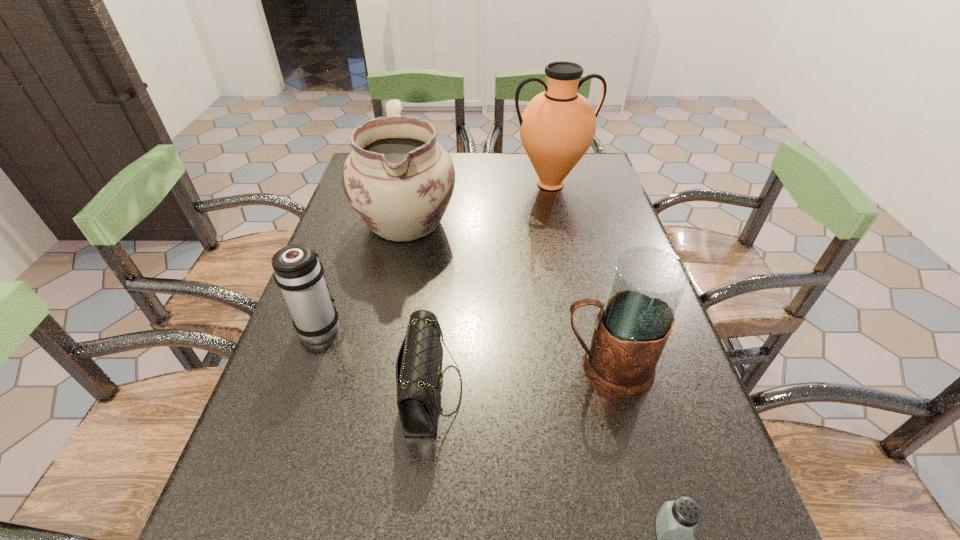
You are a GUI agent. You are given a task and a screenshot of the screen. Output one action in this format:
    pyautogui.click(x=<x>, y=<y>)
    Task: Click on the vacant space located on the side with the handle of the thermos bottle
    
    Given the screenshot: What is the action you would take?
    pyautogui.click(x=346, y=253)

This screenshot has height=540, width=960. What are the coordinates of `free region located on the side with the handle of the thermos bottle` in the screenshot? It's located at (339, 272).

Identify the location of free space located 0.350m on the side with the handle of the thermos bottle. The image size is (960, 540). (358, 217).

Where is `free space located 0.100m on the front flap of the clutch bag`? The width and height of the screenshot is (960, 540). free space located 0.100m on the front flap of the clutch bag is located at coordinates (515, 390).

This screenshot has height=540, width=960. What are the coordinates of `pitcher that is at the left edge` in the screenshot? It's located at (398, 179).

At what (x,y) coordinates should I click in order to perform the action: click on thermos bottle that is at the left edge. Please return your answer as a coordinate pair (x, y). The width and height of the screenshot is (960, 540). Looking at the image, I should click on (297, 271).

At what (x,y) coordinates should I click in order to perform the action: click on object situated at the far left corner. Please return your answer as a coordinate pair (x, y). This screenshot has width=960, height=540. Looking at the image, I should click on (398, 179).

The height and width of the screenshot is (540, 960). What are the coordinates of `object present at the far right corner` in the screenshot? It's located at (557, 127).

I want to click on vacant space at the far edge of the desktop, so click(501, 185).

Find the location of a particular element. This screenshot has width=960, height=540. free space at the left edge of the desktop is located at coordinates (347, 204).